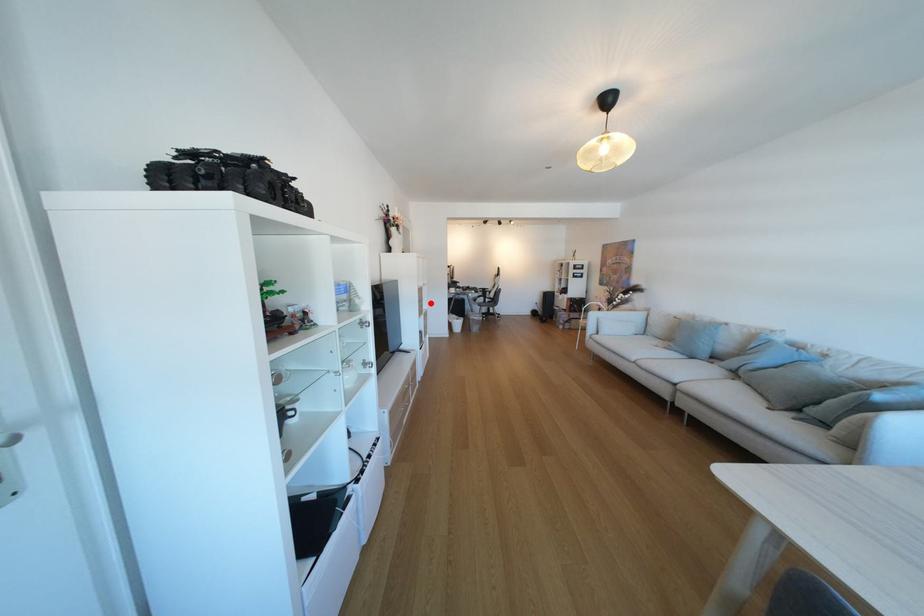
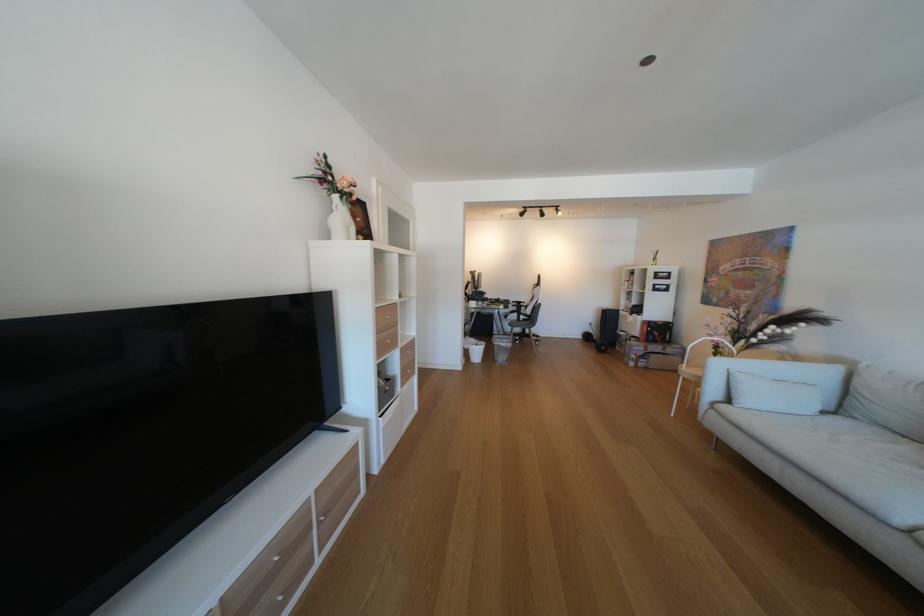
Where in the second image is the point corresponding to the highlighted location from the first image?

(390, 331)